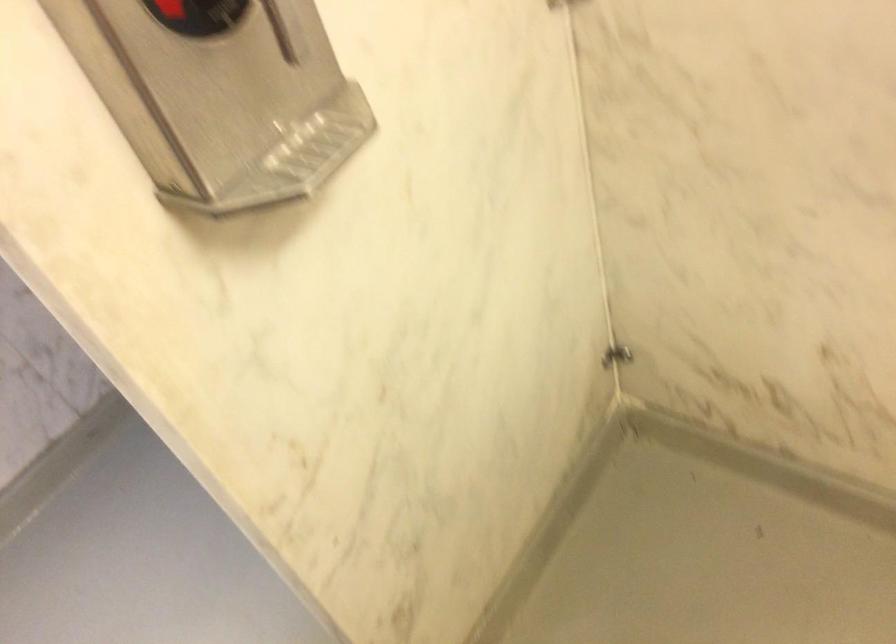
This screenshot has width=896, height=644. What are the coordinates of `metal dispenser lever` in the screenshot? It's located at (281, 31).